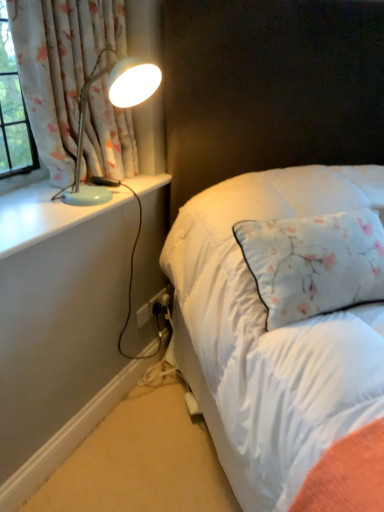
Question: From the image's perspective, is matte blue lamp at left under white glossy window sill at left?

Choices:
 (A) no
 (B) yes

Answer: (A)

Question: Is matte blue lamp at left bigger than white glossy window sill at left?

Choices:
 (A) no
 (B) yes

Answer: (B)

Question: Is matte blue lamp at left further to the viewer compared to white glossy window sill at left?

Choices:
 (A) yes
 (B) no

Answer: (A)

Question: Is matte blue lamp at left taller than white glossy window sill at left?

Choices:
 (A) no
 (B) yes

Answer: (B)

Question: From a real-world perspective, is matte blue lamp at left below white glossy window sill at left?

Choices:
 (A) no
 (B) yes

Answer: (A)

Question: Is white glossy window sill at left located within matte blue lamp at left?

Choices:
 (A) yes
 (B) no

Answer: (B)

Question: Is white glossy window sill at left oriented towards floral fabric curtain at upper left?

Choices:
 (A) no
 (B) yes

Answer: (A)

Question: Is there a large distance between white glossy window sill at left and floral fabric curtain at upper left?

Choices:
 (A) no
 (B) yes

Answer: (A)

Question: Can you confirm if white glossy window sill at left is thinner than floral fabric curtain at upper left?

Choices:
 (A) no
 (B) yes

Answer: (A)

Question: From the image's perspective, is white glossy window sill at left beneath floral fabric curtain at upper left?

Choices:
 (A) no
 (B) yes

Answer: (B)

Question: Is white glossy window sill at left at the left side of floral fabric curtain at upper left?

Choices:
 (A) yes
 (B) no

Answer: (A)

Question: Is the depth of white glossy window sill at left greater than that of floral fabric curtain at upper left?

Choices:
 (A) yes
 (B) no

Answer: (B)

Question: From the image's perspective, would you say black plastic electric outlet at lower center is shown under white matte power strip at lower center?

Choices:
 (A) no
 (B) yes

Answer: (A)